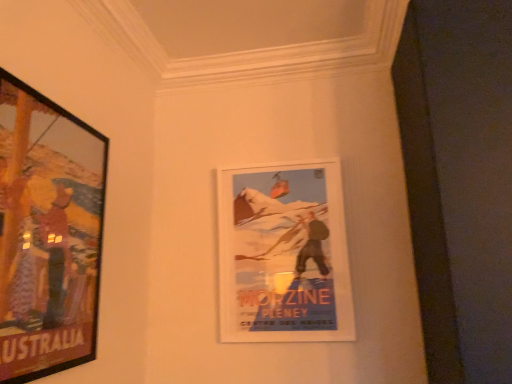
Question: Is wooden-framed poster at left, the first picture frame in the front-to-back sequence, not near white paper poster at center, which appears as the 1th picture frame when viewed from the right?

Choices:
 (A) yes
 (B) no

Answer: (B)

Question: Is wooden-framed poster at left, the first picture frame in the front-to-back sequence, not within white paper poster at center, positioned as the second picture frame in left-to-right order?

Choices:
 (A) no
 (B) yes

Answer: (B)

Question: Does wooden-framed poster at left, the first picture frame in the front-to-back sequence, turn towards white paper poster at center, which appears as the 1th picture frame when viewed from the right?

Choices:
 (A) yes
 (B) no

Answer: (B)

Question: Is wooden-framed poster at left, the first picture frame in the front-to-back sequence, oriented away from white paper poster at center, arranged as the 2th picture frame when viewed from the front?

Choices:
 (A) yes
 (B) no

Answer: (B)

Question: From a real-world perspective, is wooden-framed poster at left, the first picture frame in the front-to-back sequence, located beneath white paper poster at center, which ranks as the first picture frame in back-to-front order?

Choices:
 (A) yes
 (B) no

Answer: (B)

Question: Is wooden-framed poster at left, the 2th picture frame when ordered from right to left, positioned before white paper poster at center, which ranks as the first picture frame in back-to-front order?

Choices:
 (A) no
 (B) yes

Answer: (B)

Question: From the image's perspective, is white paper poster at center, which appears as the 1th picture frame when viewed from the right, on top of wooden-framed poster at left, the 2th picture frame when ordered from right to left?

Choices:
 (A) yes
 (B) no

Answer: (B)

Question: From the image's perspective, is white paper poster at center, positioned as the second picture frame in left-to-right order, beneath wooden-framed poster at left, positioned as the second picture frame in back-to-front order?

Choices:
 (A) yes
 (B) no

Answer: (A)

Question: Considering the relative sizes of white paper poster at center, arranged as the 2th picture frame when viewed from the front, and wooden-framed poster at left, the first picture frame in the front-to-back sequence, in the image provided, is white paper poster at center, arranged as the 2th picture frame when viewed from the front, smaller than wooden-framed poster at left, the first picture frame in the front-to-back sequence,?

Choices:
 (A) yes
 (B) no

Answer: (A)

Question: Is wooden-framed poster at left, the first picture frame positioned from the left, inside white paper poster at center, which appears as the 1th picture frame when viewed from the right?

Choices:
 (A) no
 (B) yes

Answer: (A)

Question: Is white paper poster at center, arranged as the 2th picture frame when viewed from the front, shorter than wooden-framed poster at left, the 2th picture frame when ordered from right to left?

Choices:
 (A) yes
 (B) no

Answer: (A)

Question: Does white paper poster at center, which ranks as the first picture frame in back-to-front order, have a greater width compared to wooden-framed poster at left, the first picture frame positioned from the left?

Choices:
 (A) no
 (B) yes

Answer: (A)

Question: Would you say white paper poster at center, which ranks as the first picture frame in back-to-front order, is inside or outside wooden-framed poster at left, the first picture frame in the front-to-back sequence?

Choices:
 (A) outside
 (B) inside

Answer: (A)